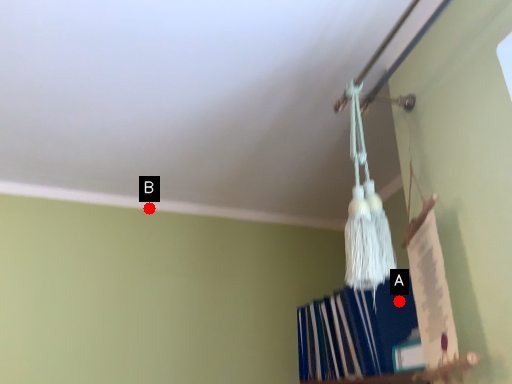
Question: Two points are circled on the image, labeled by A and B beside each circle. Which point is further to the camera?

Choices:
 (A) A is further
 (B) B is further

Answer: (B)